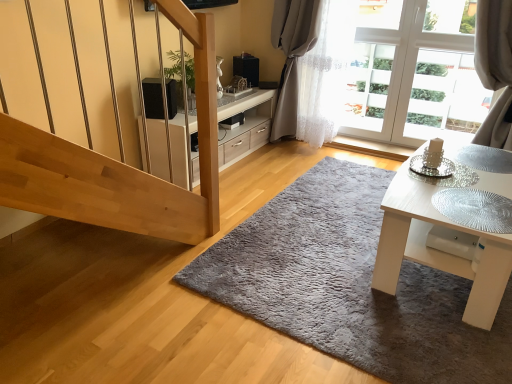
Where is `free space above white glossy table at lower right (from a real-world perspective)`? This screenshot has height=384, width=512. free space above white glossy table at lower right (from a real-world perspective) is located at coordinates (462, 172).